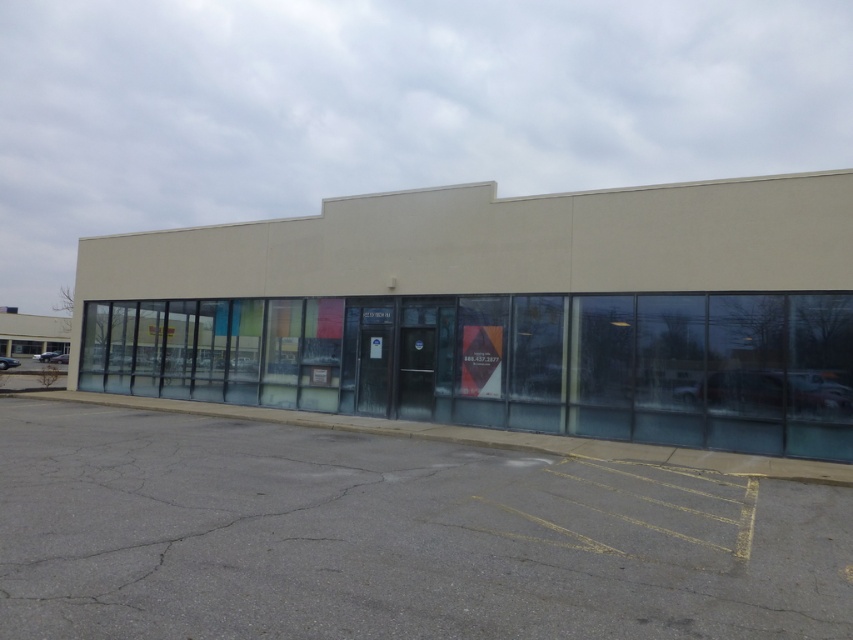
Question: Which of the following is the closest to the observer?

Choices:
 (A) (225, 566)
 (B) (460, 381)

Answer: (A)

Question: Is beige concrete building at center closer to the viewer compared to gray asphalt parking lot at lower center?

Choices:
 (A) no
 (B) yes

Answer: (A)

Question: Can you confirm if beige concrete building at center is thinner than gray asphalt parking lot at lower center?

Choices:
 (A) yes
 (B) no

Answer: (B)

Question: Can you confirm if beige concrete building at center is positioned to the right of gray asphalt parking lot at lower center?

Choices:
 (A) no
 (B) yes

Answer: (A)

Question: Which point is farther from the camera taking this photo?

Choices:
 (A) pos(822,204)
 (B) pos(134,595)

Answer: (A)

Question: Which point is closer to the camera?

Choices:
 (A) tap(399, 316)
 (B) tap(86, 588)

Answer: (B)